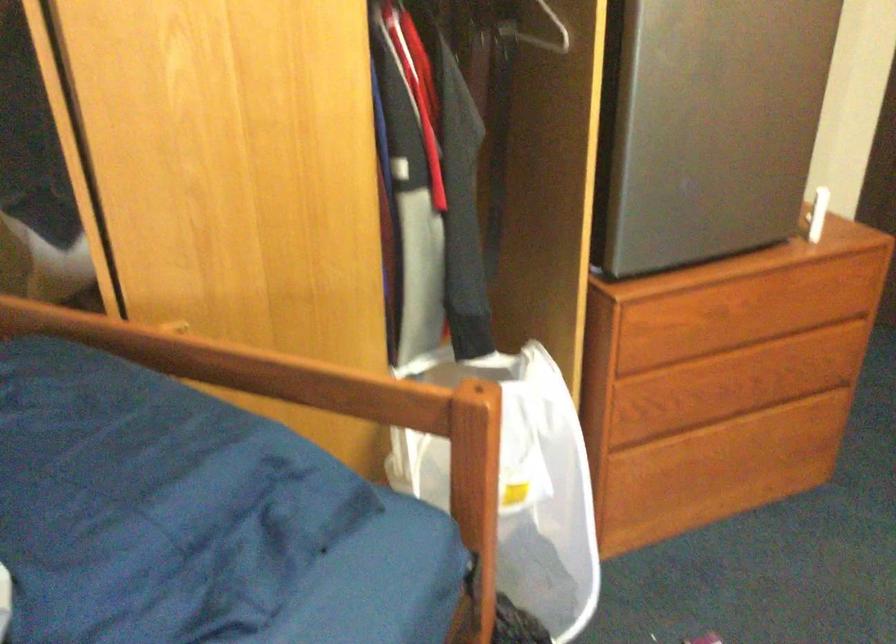
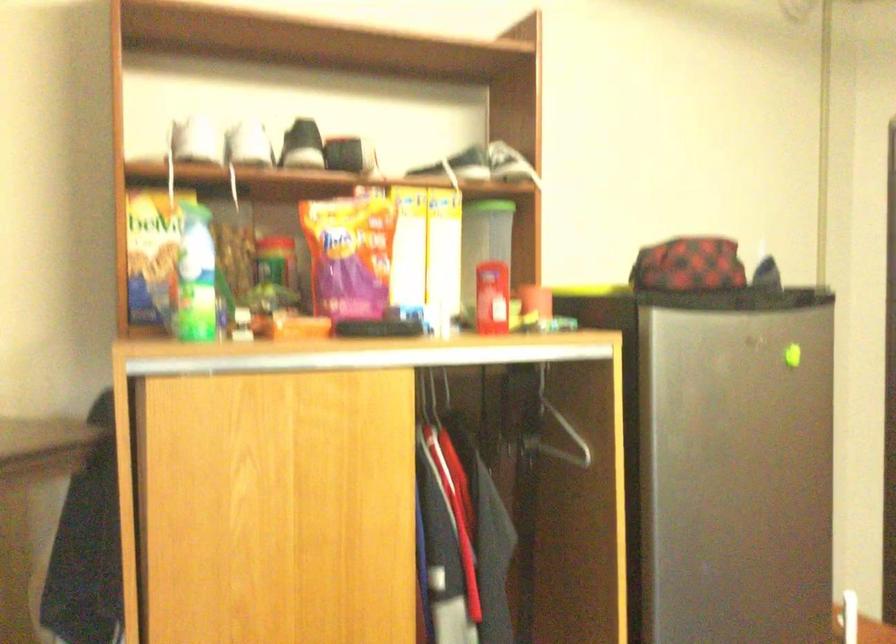
Question: How did the camera likely rotate?

Choices:
 (A) Left
 (B) Right
 (C) Up
 (D) Down

Answer: (C)